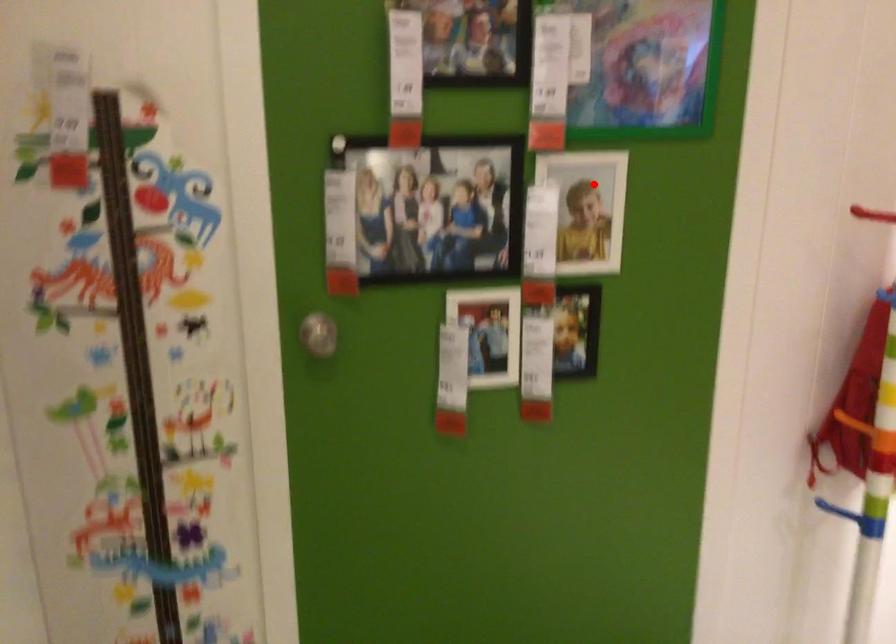
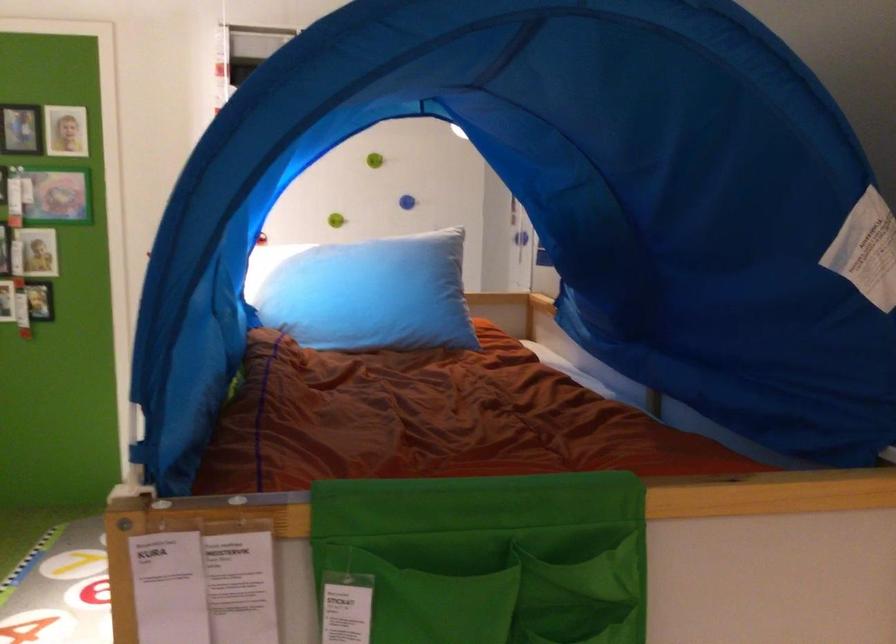
Question: I am providing you with two images of the same scene from different viewpoints. Image1 has a red point marked. In image2, the corresponding 3D location appears at what relative position? Reply with the corresponding letter.

Choices:
 (A) Closer
 (B) Farther

Answer: (B)